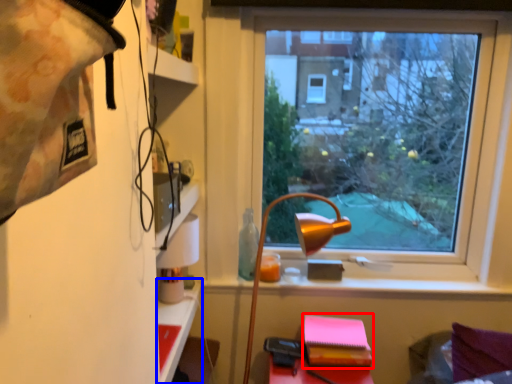
Question: Which object appears closest to the camera in this image, notebook (highlighted by a red box) or table (highlighted by a blue box)?

Choices:
 (A) notebook
 (B) table

Answer: (B)